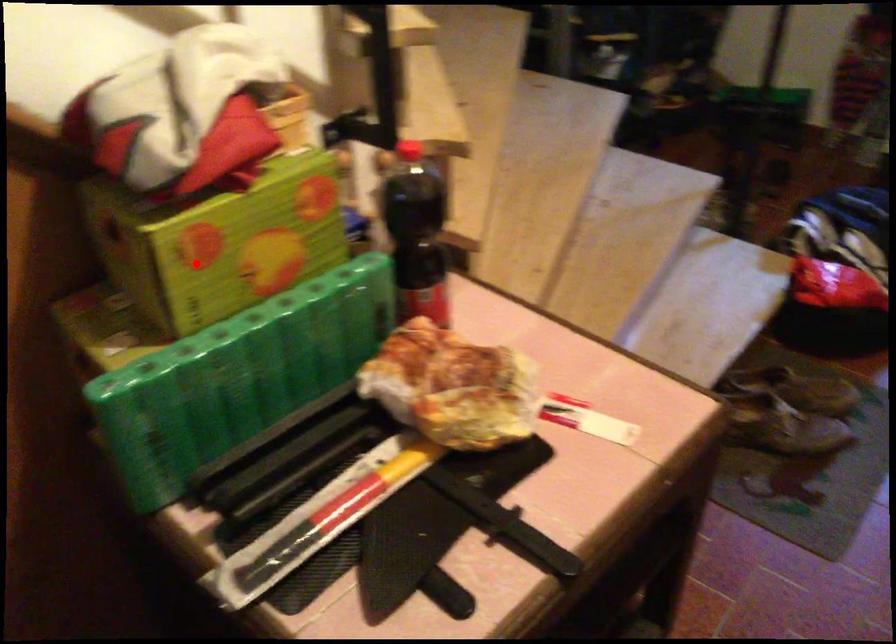
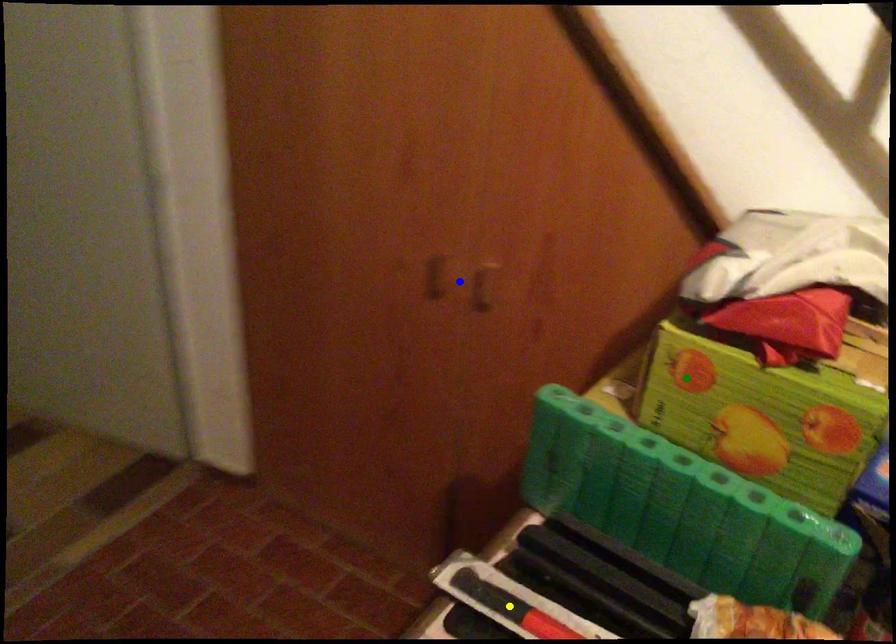
Question: I am providing you with two images of the same scene from different viewpoints. A red point is marked on the first image. You are given multiple points on the second image. Which point in image 2 is actually the same real-world point as the red point in image 1?

Choices:
 (A) yellow point
 (B) blue point
 (C) green point

Answer: (C)